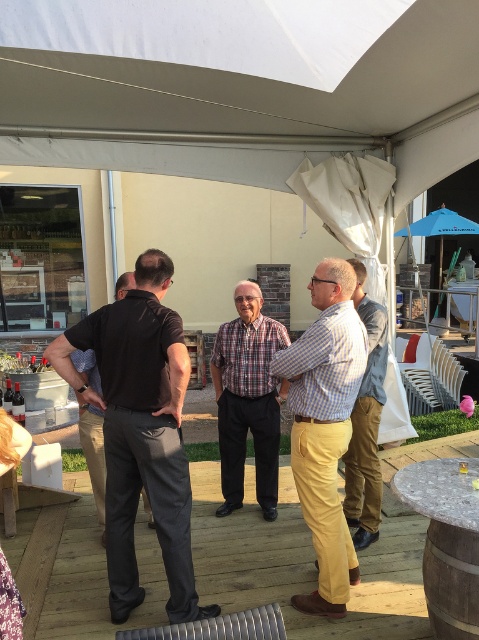
Does dark gray pants at left appear on the right side of checkered fabric shirt at center?

No, dark gray pants at left is not to the right of checkered fabric shirt at center.

Can you confirm if dark gray pants at left is taller than checkered fabric shirt at center?

Correct, dark gray pants at left is much taller as checkered fabric shirt at center.

Between point (66, 355) and point (351, 340), which one is positioned behind?

The point (351, 340) is more distant.

Identify the location of dark gray pants at left. (140, 433).

Who is more forward, (374,342) or (125,276)?

Positioned in front is point (374,342).

Which is above, light blue checkered shirt at center or black smooth shirt at center?

light blue checkered shirt at center is above.

Is point (374, 493) behind point (93, 406)?

Yes, it is.

Locate an element on the screen. light blue checkered shirt at center is located at coordinates (365, 422).

Who is shorter, checkered fabric shirt at center or blue fabric umbrella at upper right?

Standing shorter between the two is blue fabric umbrella at upper right.

Does checkered fabric shirt at center appear over blue fabric umbrella at upper right?

Incorrect, checkered fabric shirt at center is not positioned above blue fabric umbrella at upper right.

Is point (321, 390) farther from camera compared to point (436, 228)?

No, (321, 390) is closer to viewer.

I want to click on checkered fabric shirt at center, so click(x=324, y=426).